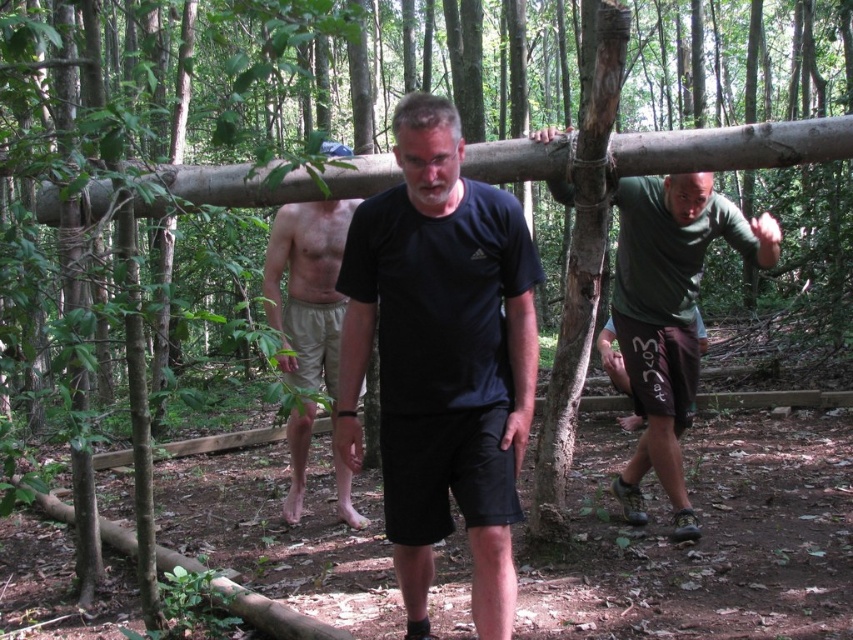
Is smooth wood beam at center above tan cotton shorts at center?

Correct, smooth wood beam at center is located above tan cotton shorts at center.

Identify the location of smooth wood beam at center. The height and width of the screenshot is (640, 853). (732, 147).

Is point (692, 184) positioned after point (322, 230)?

No, (692, 184) is in front of (322, 230).

Does point (685, 344) lie behind point (345, 234)?

No.

Where is `dark green jersey at upper right`? This screenshot has width=853, height=640. dark green jersey at upper right is located at coordinates point(669,316).

Does dark green jersey at upper right have a lesser height compared to smooth wood beam at center?

No, dark green jersey at upper right is not shorter than smooth wood beam at center.

What do you see at coordinates (669, 316) in the screenshot? I see `dark green jersey at upper right` at bounding box center [669, 316].

Measure the distance between dark green jersey at upper right and camera.

A distance of 3.49 meters exists between dark green jersey at upper right and camera.

Identify the location of dark green jersey at upper right. The image size is (853, 640). (669, 316).